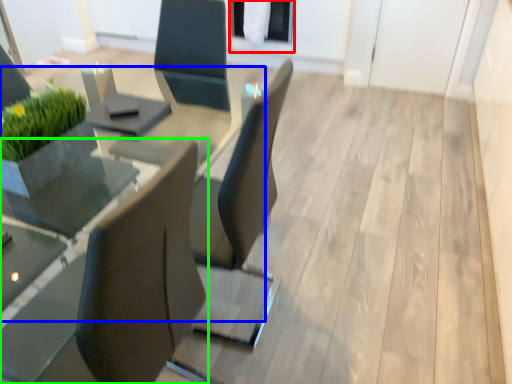
Question: Considering the real-world distances, which object is farthest from glass door (highlighted by a red box)? round table (highlighted by a blue box) or chair (highlighted by a green box)?

Choices:
 (A) round table
 (B) chair

Answer: (B)